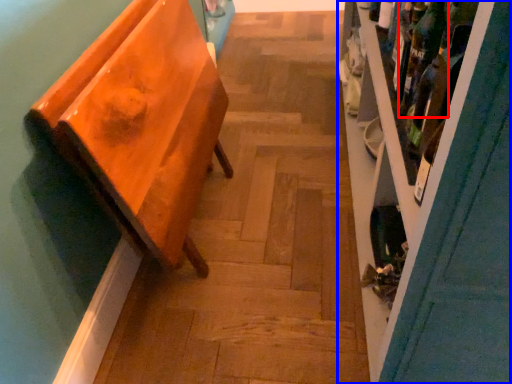
Question: Which of the following is the closest to the observer, wine bottle (highlighted by a red box) or shelf (highlighted by a blue box)?

Choices:
 (A) wine bottle
 (B) shelf

Answer: (B)